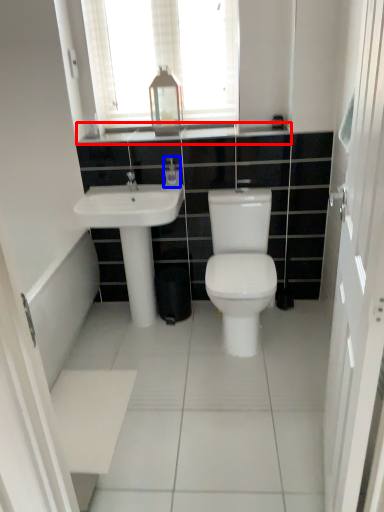
Question: Which of the following is the closest to the observer, counter top (highlighted by a red box) or toiletry (highlighted by a blue box)?

Choices:
 (A) counter top
 (B) toiletry

Answer: (A)